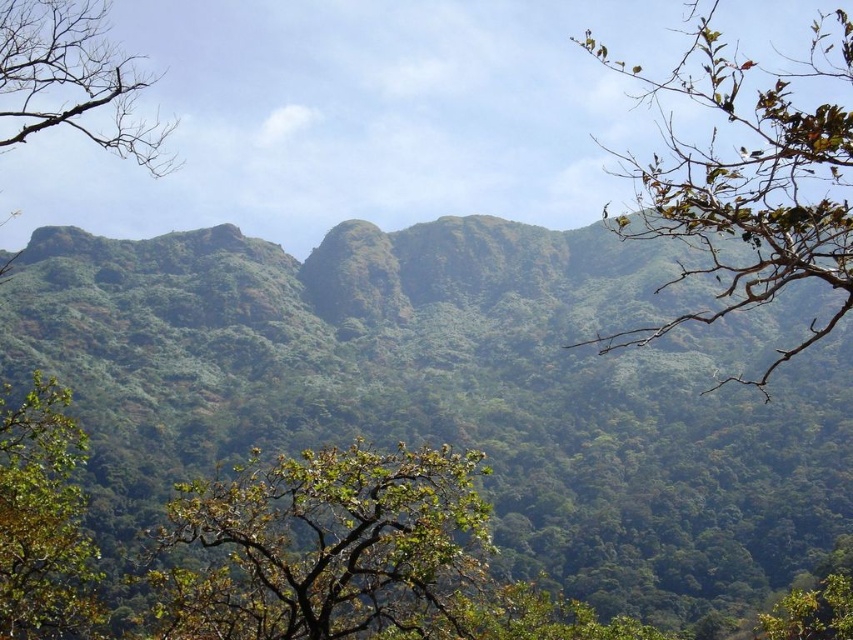
In the scene shown: Does green leafy tree at center have a lesser width compared to green leafy tree at upper left?

Correct, green leafy tree at center's width is less than green leafy tree at upper left's.

Is point (257, 464) positioned after point (93, 44)?

No, (257, 464) is closer to viewer.

Identify the location of green leafy tree at center. (328, 548).

Where is `green leafy mountain at center`? Image resolution: width=853 pixels, height=640 pixels. green leafy mountain at center is located at coordinates (457, 390).

Does point (109, 525) lie behind point (161, 586)?

Yes, it is behind point (161, 586).

Who is more forward, (709, 352) or (376, 504)?

Point (376, 504) is more forward.

Identify the location of green leafy mountain at center. (457, 390).

Is green leafy tree at center further to camera compared to green leafy tree at upper right?

Yes, green leafy tree at center is behind green leafy tree at upper right.

Does green leafy tree at center appear on the left side of green leafy tree at upper right?

Correct, you'll find green leafy tree at center to the left of green leafy tree at upper right.

You are a GUI agent. You are given a task and a screenshot of the screen. Output one action in this format:
    pyautogui.click(x=<x>, y=<y>)
    Task: Click on the green leafy tree at center
    This screenshot has height=640, width=853.
    Given the screenshot: What is the action you would take?
    pyautogui.click(x=328, y=548)